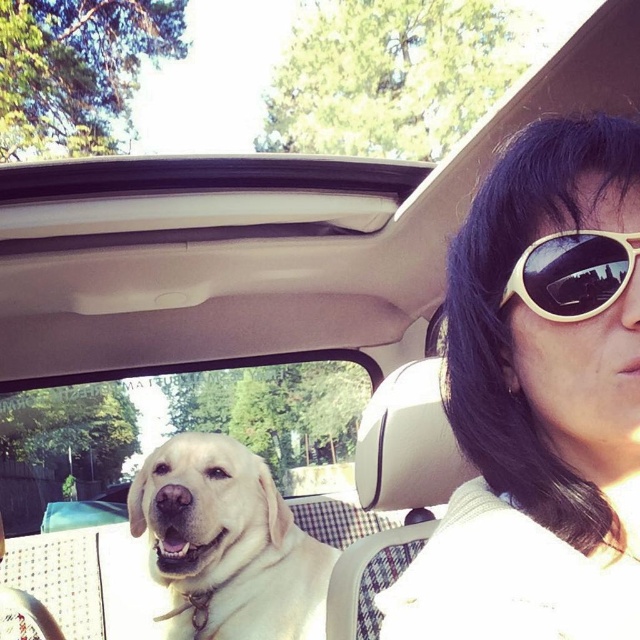
Question: Is white matte sunglasses at upper right to the left of clear glass window at center from the viewer's perspective?

Choices:
 (A) yes
 (B) no

Answer: (B)

Question: Which object is positioned farthest from the white matte sunglasses at upper right?

Choices:
 (A) clear glass window at center
 (B) white plastic sunglasses at upper right

Answer: (A)

Question: Which point is closer to the camera?

Choices:
 (A) clear glass window at center
 (B) white matte sunglasses at upper right
 (C) yellow fur dog at center
 (D) white plastic sunglasses at upper right

Answer: (B)

Question: Does white matte sunglasses at upper right have a lesser width compared to clear glass window at center?

Choices:
 (A) yes
 (B) no

Answer: (A)

Question: Is clear glass window at center closer to the viewer compared to yellow fur dog at center?

Choices:
 (A) yes
 (B) no

Answer: (B)

Question: Estimate the real-world distances between objects in this image. Which object is closer to the white matte sunglasses at upper right?

Choices:
 (A) clear glass window at center
 (B) white plastic sunglasses at upper right
 (C) yellow fur dog at center

Answer: (B)